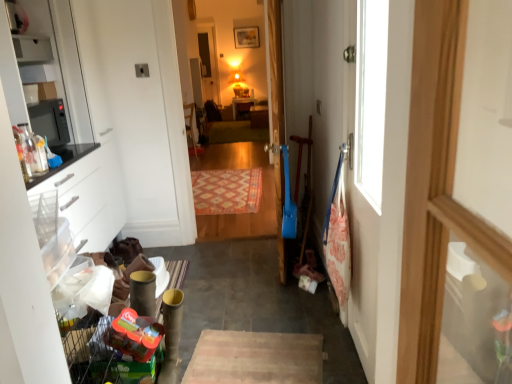
The width and height of the screenshot is (512, 384). What are the coordinates of `vacant area in front of blue plastic door at center` in the screenshot? It's located at (266, 298).